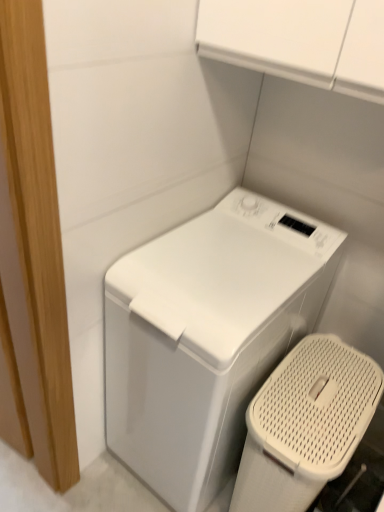
Question: Considering the positions of point (230, 364) and point (357, 411), is point (230, 364) closer or farther from the camera than point (357, 411)?

Choices:
 (A) closer
 (B) farther

Answer: (A)

Question: Considering the positions of white glossy washing machine at center and white mesh laundry basket at lower right in the image, is white glossy washing machine at center taller or shorter than white mesh laundry basket at lower right?

Choices:
 (A) short
 (B) tall

Answer: (B)

Question: Looking at their shapes, would you say white glossy washing machine at center is wider or thinner than white mesh laundry basket at lower right?

Choices:
 (A) thin
 (B) wide

Answer: (B)

Question: Is white mesh laundry basket at lower right to the left or to the right of white glossy washing machine at center in the image?

Choices:
 (A) right
 (B) left

Answer: (A)

Question: From the image's perspective, is white mesh laundry basket at lower right located above or below white glossy washing machine at center?

Choices:
 (A) above
 (B) below

Answer: (B)

Question: Which is correct: white mesh laundry basket at lower right is inside white glossy washing machine at center, or outside of it?

Choices:
 (A) outside
 (B) inside

Answer: (A)

Question: Based on their sizes in the image, would you say white mesh laundry basket at lower right is bigger or smaller than white glossy washing machine at center?

Choices:
 (A) big
 (B) small

Answer: (B)